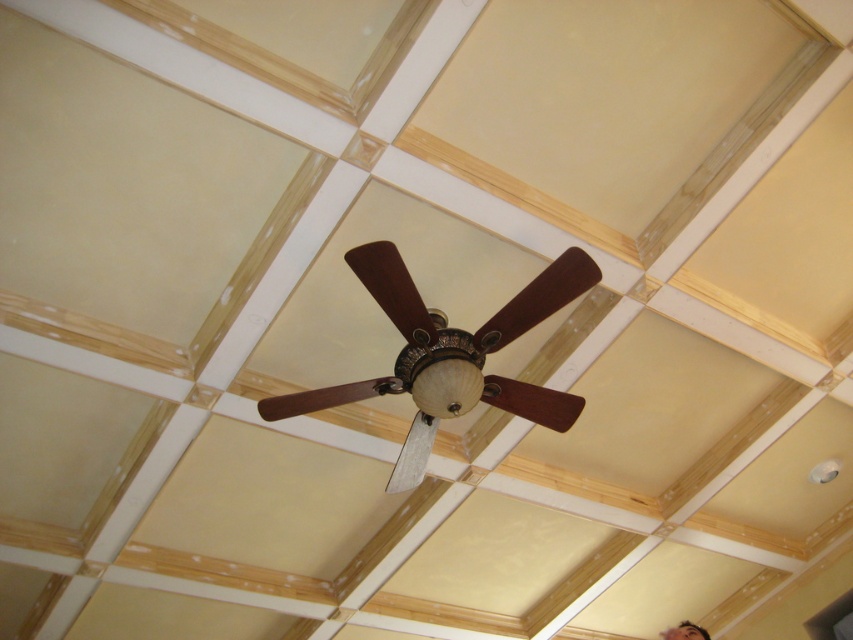
Is wooden ceiling fan at center thinner than smooth skin face at lower right?

No, wooden ceiling fan at center is not thinner than smooth skin face at lower right.

Between point (450, 401) and point (699, 632), which one is positioned behind?

Positioned behind is point (699, 632).

Identify the location of wooden ceiling fan at center. (450, 355).